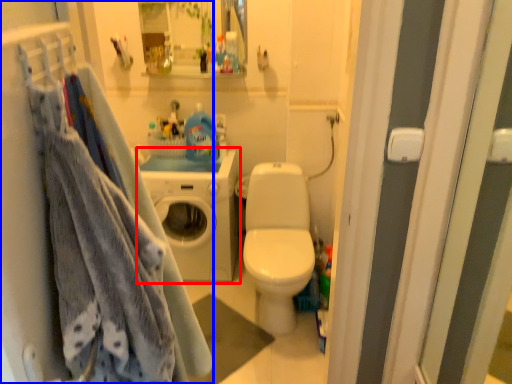
Question: Which object appears farthest to the camera in this image, washing machine (highlighted by a red box) or closet (highlighted by a blue box)?

Choices:
 (A) washing machine
 (B) closet

Answer: (A)